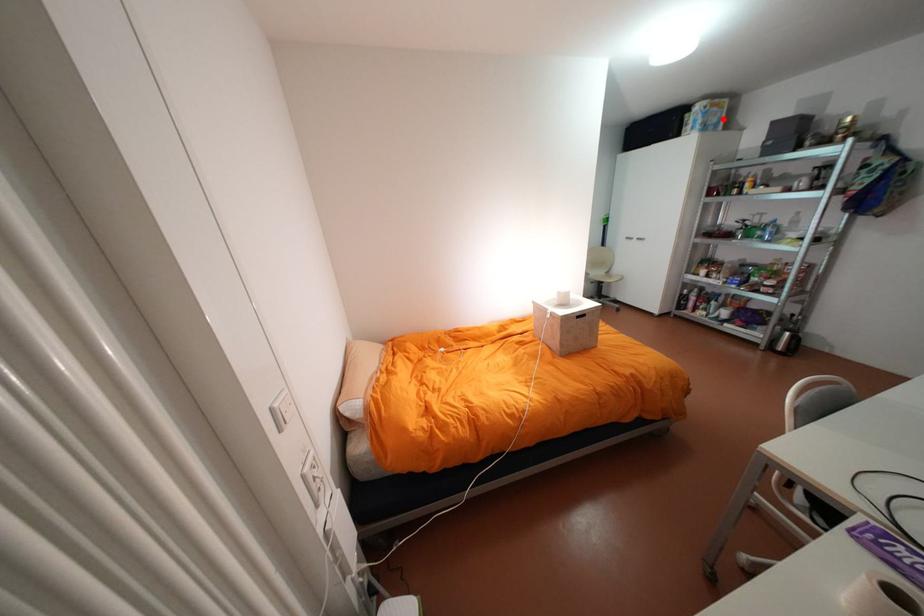
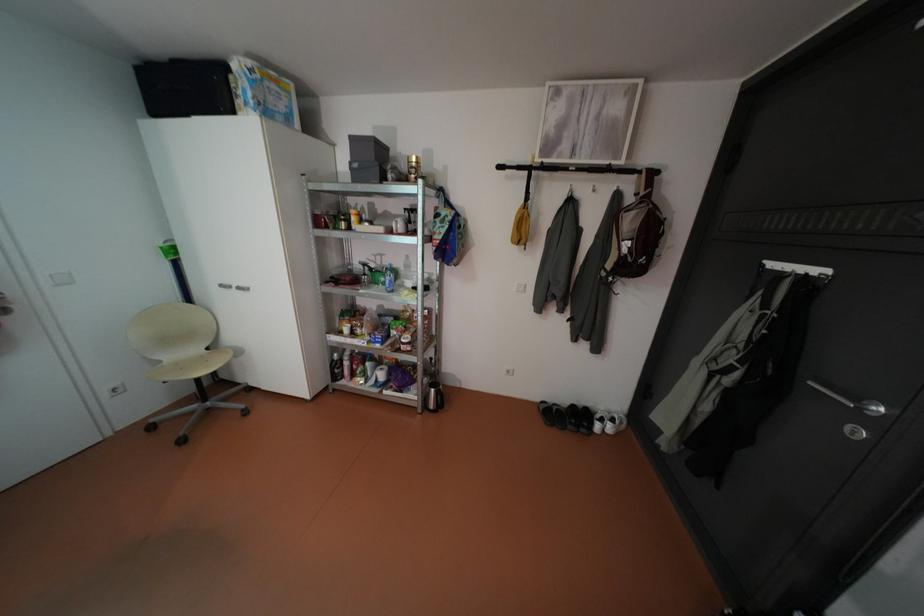
In the second image, find the point that corresponds to the highlighted location in the first image.

(290, 107)